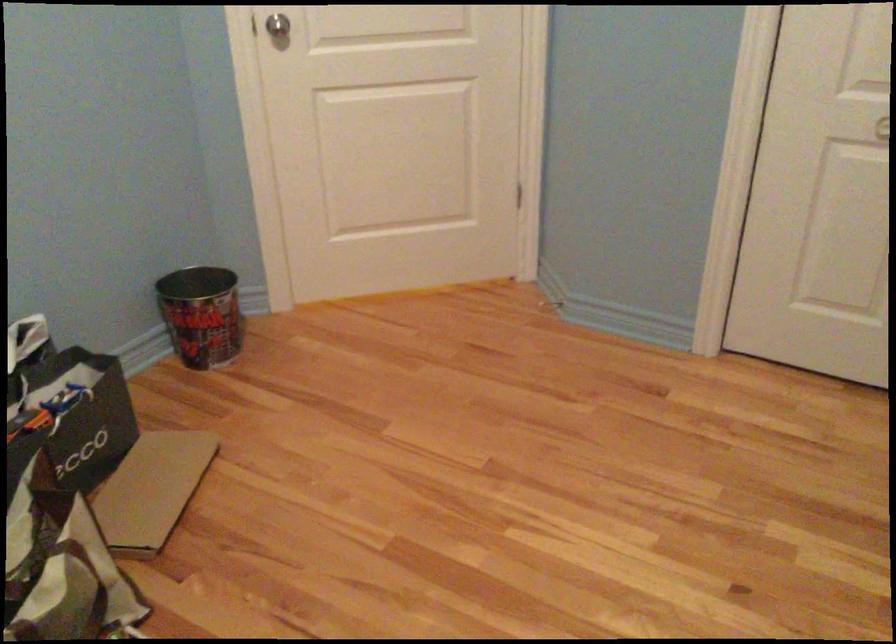
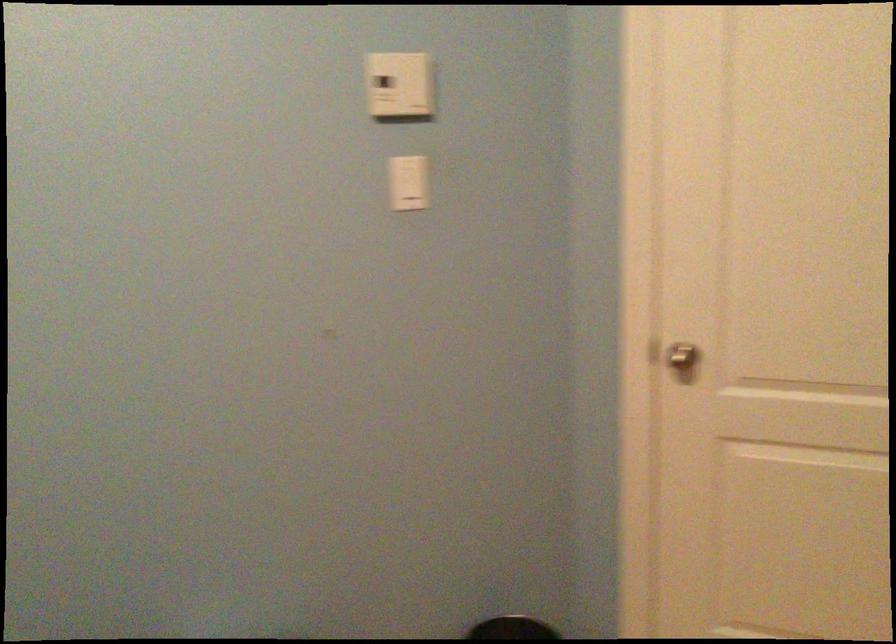
Question: Based on the continuous images, in which direction is the camera rotating? Reply with the corresponding letter.

Choices:
 (A) Left
 (B) Right
 (C) Up
 (D) Down

Answer: (A)